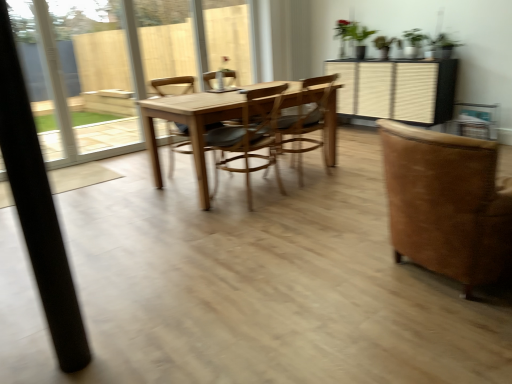
This screenshot has width=512, height=384. I want to click on vacant region to the left of black matte pole at left, so click(31, 359).